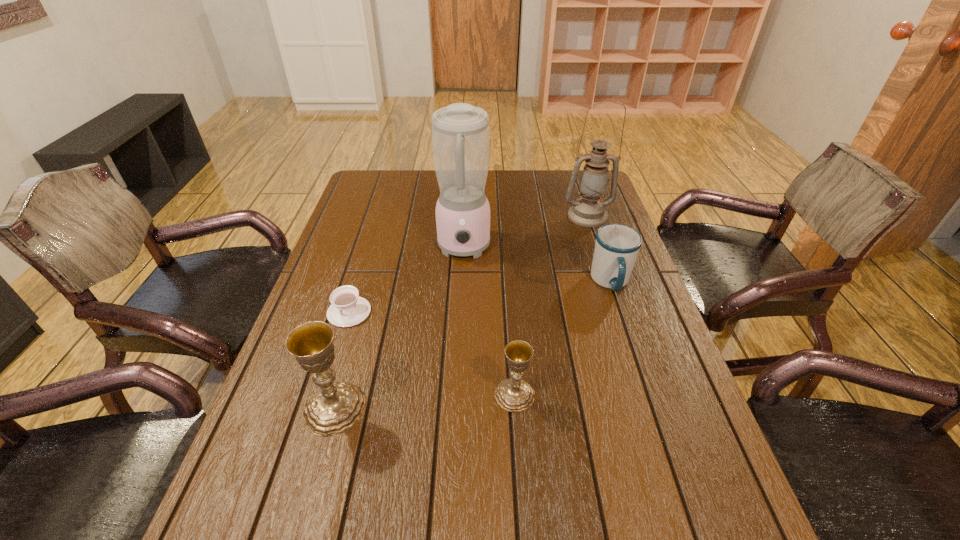
The width and height of the screenshot is (960, 540). Find the location of `empty location between the food processor and the teacup`. empty location between the food processor and the teacup is located at coordinates (406, 280).

The height and width of the screenshot is (540, 960). In order to click on blank region between the third object from left to right and the mug in this screenshot , I will do `click(538, 266)`.

Find the location of a particular element. The image size is (960, 540). unoccupied position between the shortest object and the mug is located at coordinates (480, 297).

Where is `object that can be found as the fourth closest to the shortest object`? object that can be found as the fourth closest to the shortest object is located at coordinates (617, 245).

Locate which object is the fourth closest to the teacup. Please provide its 2D coordinates. Your answer should be formatted as a tuple, i.e. [(x, y)], where the tuple contains the x and y coordinates of a point satisfying the conditions above.

[(617, 245)]

I want to click on vacant space that satisfies the following two spatial constraints: 1. on the base of the right chalice near the control knob; 2. on the right side of the food processor, so click(x=457, y=395).

Where is `free space that satisfies the following two spatial constraints: 1. on the handle side of the third object from right to left; 2. on the left side of the shortest object`? The height and width of the screenshot is (540, 960). free space that satisfies the following two spatial constraints: 1. on the handle side of the third object from right to left; 2. on the left side of the shortest object is located at coordinates (324, 395).